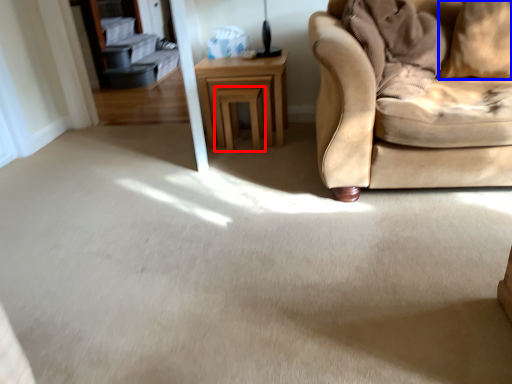
Question: Among these objects, which one is nearest to the camera, stool (highlighted by a red box) or pillow (highlighted by a blue box)?

Choices:
 (A) stool
 (B) pillow

Answer: (B)